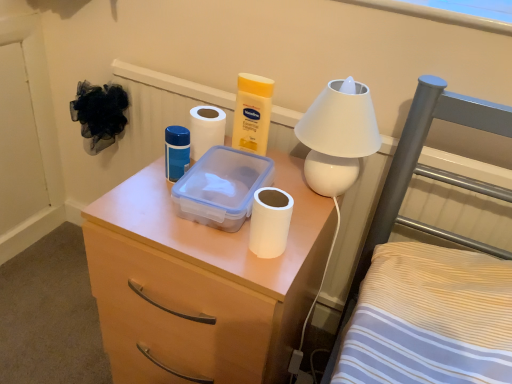
Find the location of `free spot in front of white matte toilet paper at center, which is the first toilet paper from left to right`. free spot in front of white matte toilet paper at center, which is the first toilet paper from left to right is located at coordinates (153, 199).